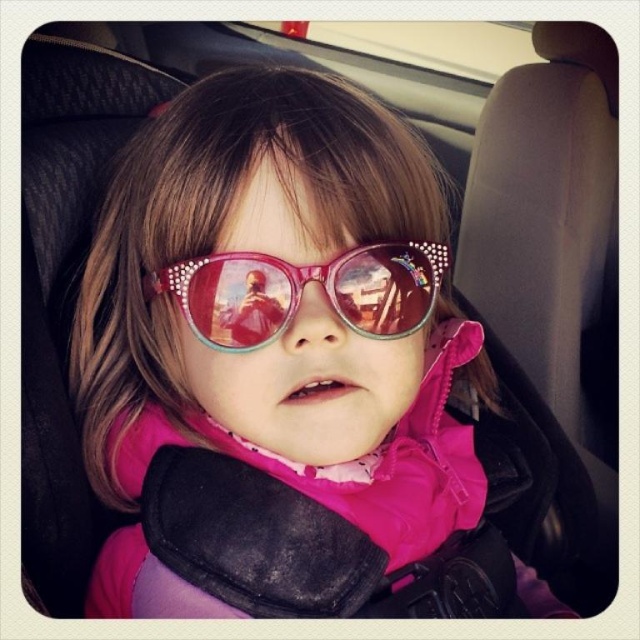
Question: Is pink glossy sunglasses at center wider than translucent pink plastic goggles at center?

Choices:
 (A) no
 (B) yes

Answer: (B)

Question: Among these objects, which one is farthest from the camera?

Choices:
 (A) translucent pink plastic goggles at center
 (B) pink glossy sunglasses at center

Answer: (A)

Question: Is pink glossy sunglasses at center smaller than translucent pink plastic goggles at center?

Choices:
 (A) no
 (B) yes

Answer: (A)

Question: Which point is farther from the camera taking this photo?

Choices:
 (A) (269, 307)
 (B) (301, 458)

Answer: (B)

Question: Does pink glossy sunglasses at center appear on the left side of translucent pink plastic goggles at center?

Choices:
 (A) no
 (B) yes

Answer: (A)